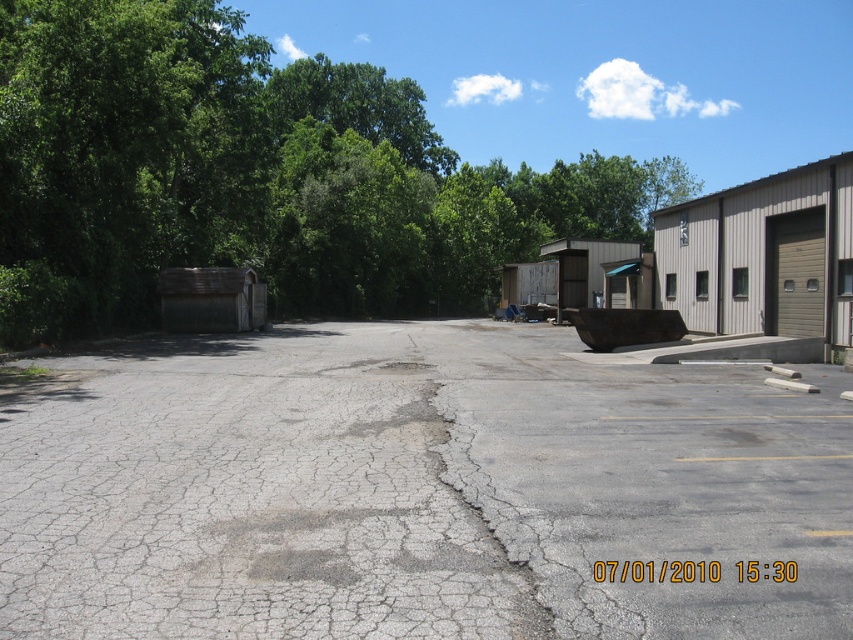
Question: Is gray cracked asphalt at center closer to the viewer compared to green leafy tree at upper left?

Choices:
 (A) yes
 (B) no

Answer: (A)

Question: Which of the following is the farthest from the observer?

Choices:
 (A) gray cracked asphalt at center
 (B) green leafy tree at upper left

Answer: (B)

Question: Does gray cracked asphalt at center have a greater width compared to green leafy tree at upper left?

Choices:
 (A) yes
 (B) no

Answer: (B)

Question: Which object is closer to the camera taking this photo?

Choices:
 (A) gray cracked asphalt at center
 (B) green leafy tree at upper left

Answer: (A)

Question: Is the position of gray cracked asphalt at center more distant than that of green leafy tree at upper left?

Choices:
 (A) yes
 (B) no

Answer: (B)

Question: Which object appears closest to the camera in this image?

Choices:
 (A) gray cracked asphalt at center
 (B) green leafy tree at upper left

Answer: (A)